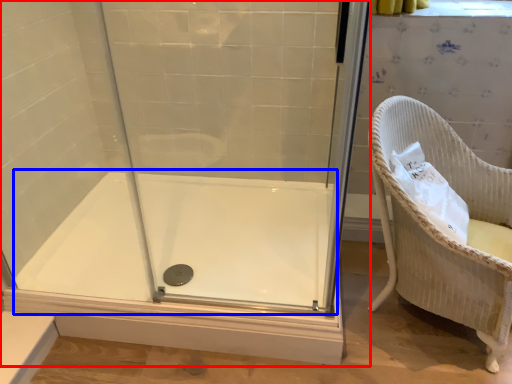
Question: Which point is closer to the camera, shower door (highlighted by a red box) or bath (highlighted by a blue box)?

Choices:
 (A) shower door
 (B) bath

Answer: (A)